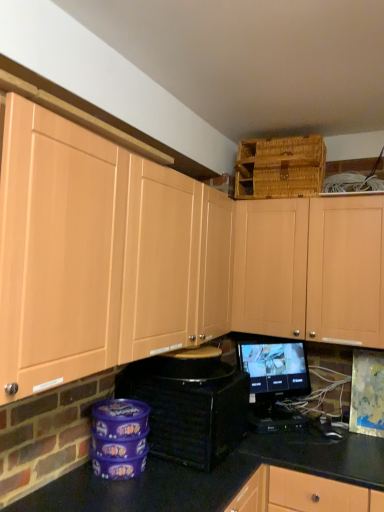
Question: From the image's perspective, is woven brown basket at upper right located above or below black glossy monitor at center?

Choices:
 (A) above
 (B) below

Answer: (A)

Question: Considering the positions of woven brown basket at upper right and black glossy monitor at center in the image, is woven brown basket at upper right wider or thinner than black glossy monitor at center?

Choices:
 (A) wide
 (B) thin

Answer: (A)

Question: Which of these objects is positioned farthest from the matte wood cabinets at upper left, the first cabinetry positioned from the left?

Choices:
 (A) matte wood cabinet at upper center, the 1th cabinetry from the right
 (B) woven brown basket at upper right
 (C) black plastic toaster at lower center
 (D) black glossy monitor at center

Answer: (B)

Question: Which of these objects is positioned closest to the matte wood cabinets at upper left, arranged as the second cabinetry when viewed from the right?

Choices:
 (A) black glossy monitor at center
 (B) woven brown basket at upper right
 (C) matte wood cabinet at upper center, the second cabinetry from the left
 (D) black plastic toaster at lower center

Answer: (D)